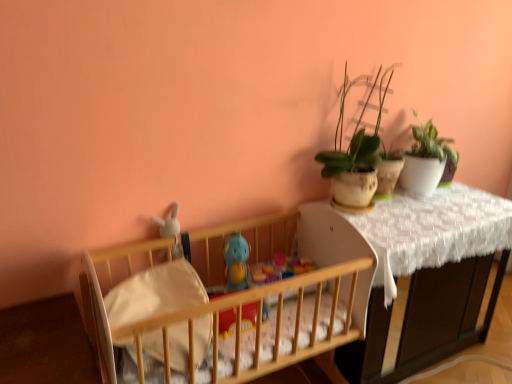
Image resolution: width=512 pixels, height=384 pixels. I want to click on free spot to the right of matte clay pot at upper right, placed as the second houseplant when sorted from right to left, so click(x=409, y=213).